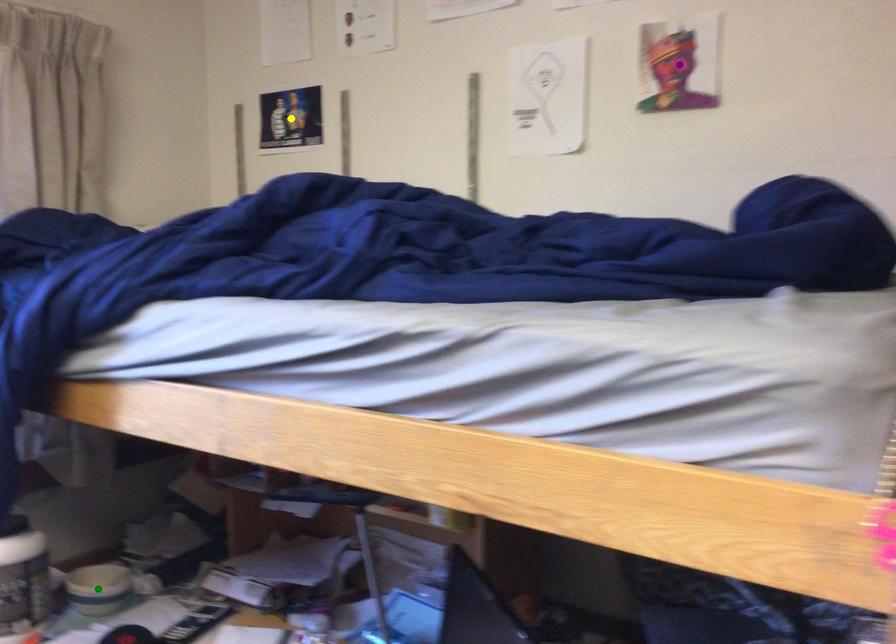
Order these from nearest to farthest:
1. yellow point
2. purple point
3. green point

purple point
green point
yellow point